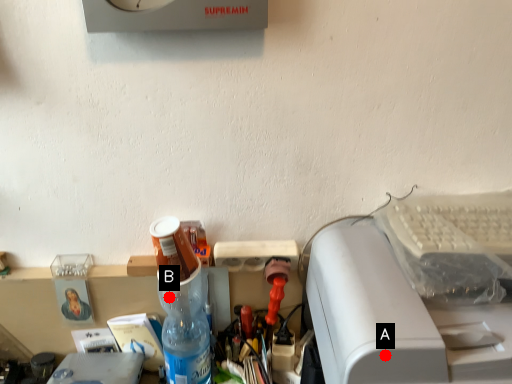
Question: Two points are circled on the image, labeled by A and B beside each circle. Which point appears closest to the camera in this image?

Choices:
 (A) A is closer
 (B) B is closer

Answer: (A)